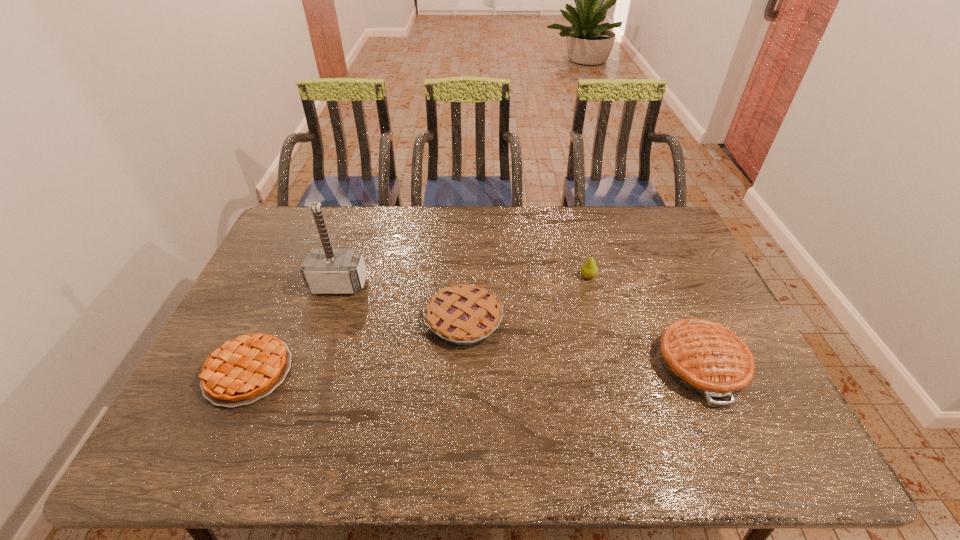
Locate an element on the screen. The width and height of the screenshot is (960, 540). free space located 0.330m on the back of the rightmost object is located at coordinates (651, 252).

This screenshot has width=960, height=540. Identify the location of vacant space located 0.210m on the right of the second shortest pie. (575, 319).

Locate an element on the screen. This screenshot has width=960, height=540. free space located on the back of the shortest object is located at coordinates (293, 274).

Where is `object that is positioned at the left edge`? Image resolution: width=960 pixels, height=540 pixels. object that is positioned at the left edge is located at coordinates (243, 370).

Locate an element on the screen. This screenshot has height=540, width=960. object that is at the right edge is located at coordinates (708, 359).

Identify the location of vacant space at the far edge of the desktop. The image size is (960, 540). (404, 231).

This screenshot has height=540, width=960. In the image, there is a desktop. What are the coordinates of `vacant space at the near edge` in the screenshot? It's located at (560, 435).

The image size is (960, 540). In the image, there is a desktop. What are the coordinates of `vacant space at the left edge` in the screenshot? It's located at (253, 324).

In the image, there is a desktop. At what (x,y) coordinates should I click in order to perform the action: click on vacant space at the far left corner. Please return your answer as a coordinate pair (x, y). The height and width of the screenshot is (540, 960). Looking at the image, I should click on (297, 223).

In the image, there is a desktop. What are the coordinates of `blank space at the near left corner` in the screenshot? It's located at point(194,453).